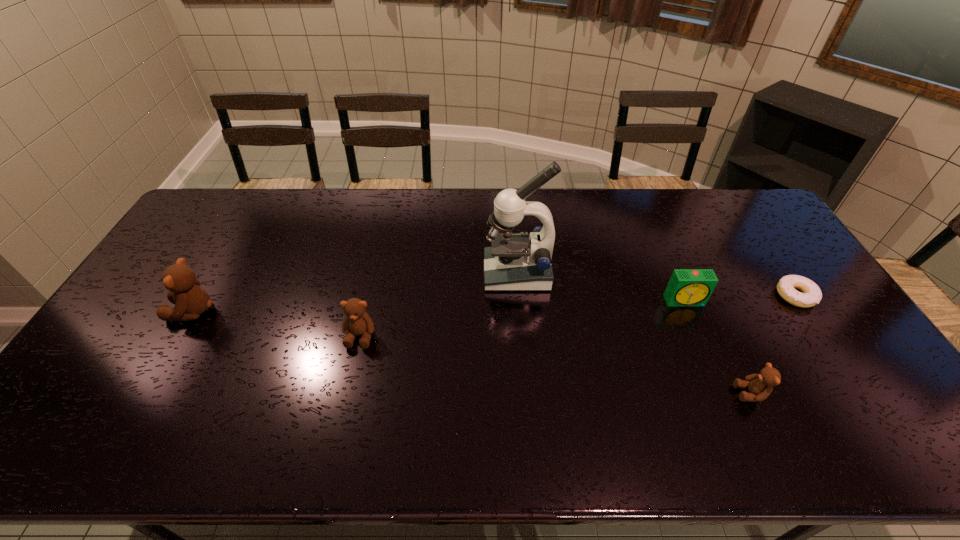
Find the location of `teddy bear that is the second closest to the nearest object`. teddy bear that is the second closest to the nearest object is located at coordinates (191, 300).

The height and width of the screenshot is (540, 960). What are the coordinates of `free location that satisfies the following two spatial constraints: 1. on the front side of the microscope; 2. on the face of the leftmost object` in the screenshot? It's located at (520, 310).